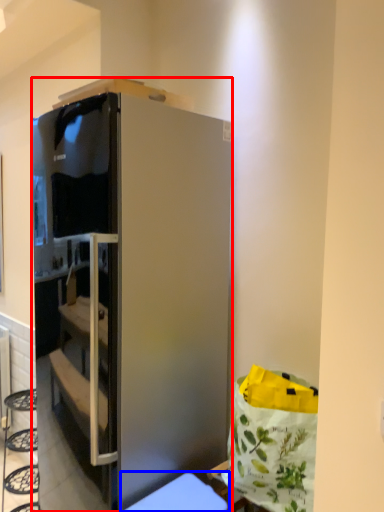
Question: Which of the following is the closest to the observer, cabinetry (highlighted by a red box) or furniture (highlighted by a blue box)?

Choices:
 (A) cabinetry
 (B) furniture

Answer: (B)